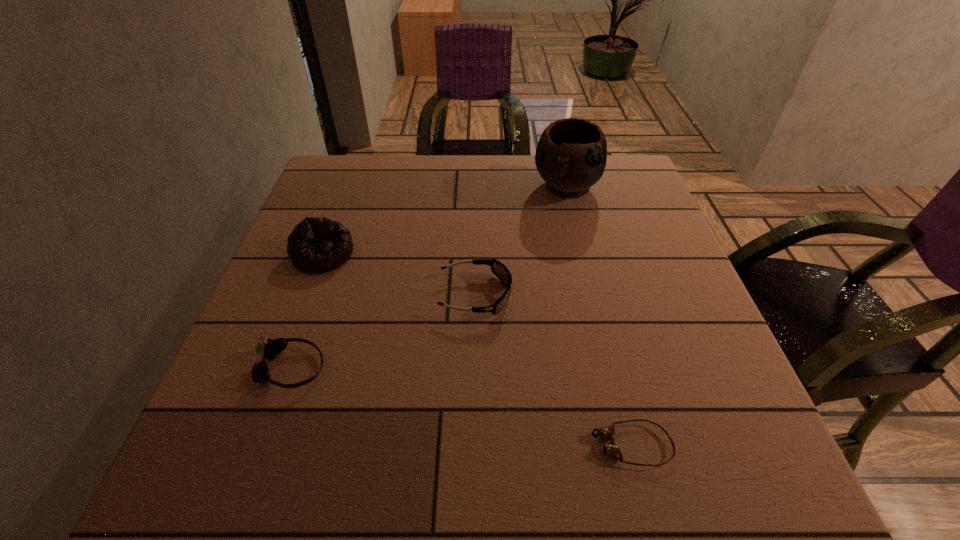
Where is `vacant space situated on the front of the fourth shortest object`? The width and height of the screenshot is (960, 540). vacant space situated on the front of the fourth shortest object is located at coordinates (257, 430).

Where is `vacant region located on the front and sides of the farthest goggles`? The image size is (960, 540). vacant region located on the front and sides of the farthest goggles is located at coordinates (662, 295).

Find the location of a particular element. vacant space situated through the lenses of the leftmost goggles is located at coordinates (460, 368).

You are a GUI agent. You are given a task and a screenshot of the screen. Output one action in this format:
    pyautogui.click(x=<x>, y=<y>)
    Task: Click on the vacant space situated 0.110m on the front lenses and sides of the rightmost goggles
    The height and width of the screenshot is (540, 960).
    Given the screenshot: What is the action you would take?
    pyautogui.click(x=520, y=445)

Locate an element on the screen. vacant point located on the front lenses and sides of the rightmost goggles is located at coordinates point(444,445).

Locate an element on the screen. The width and height of the screenshot is (960, 540). free space located 0.100m on the front lenses and sides of the rightmost goggles is located at coordinates (527, 445).

The width and height of the screenshot is (960, 540). In order to click on object that is positioned at the far edge in this screenshot , I will do `click(571, 155)`.

Where is `object positioned at the near edge`? object positioned at the near edge is located at coordinates (612, 449).

Identify the location of beanbag present at the left edge. Image resolution: width=960 pixels, height=540 pixels. (317, 244).

Where is `goggles at the left edge`? goggles at the left edge is located at coordinates click(270, 349).